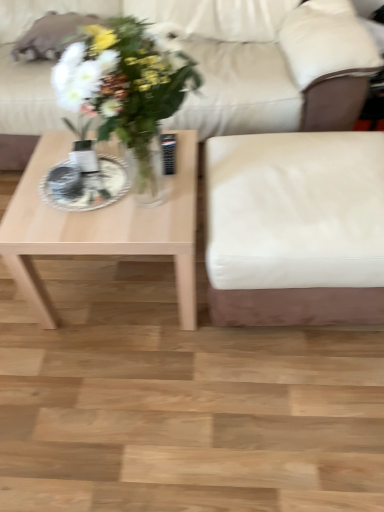
Where is `vacant space in front of light wood coffee table at left`? The image size is (384, 512). vacant space in front of light wood coffee table at left is located at coordinates (132, 391).